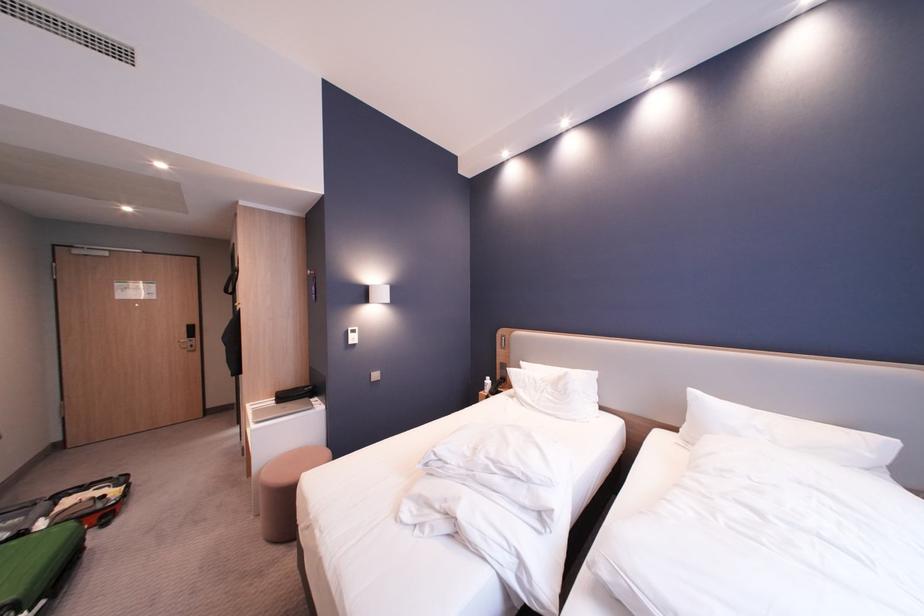
Locate an element on the screen. The image size is (924, 616). small plastic bottle is located at coordinates (487, 384).